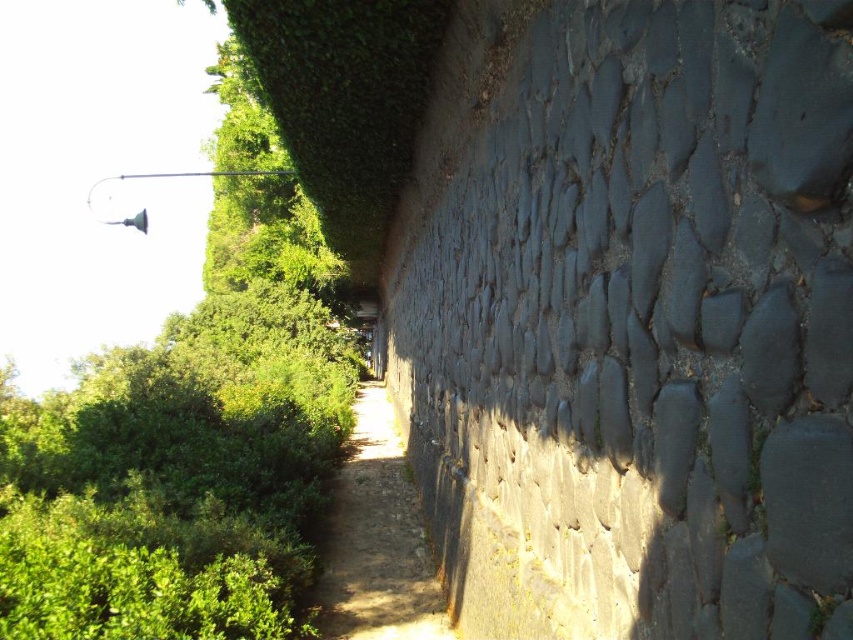
Question: Is dark gray stone wall at right smaller than green leafy tree at upper left?

Choices:
 (A) no
 (B) yes

Answer: (B)

Question: Does green leafy tree at upper left have a lesser width compared to dirt path at center?

Choices:
 (A) no
 (B) yes

Answer: (A)

Question: Which point is farther to the camera?

Choices:
 (A) (370, 448)
 (B) (235, 499)
 (C) (647, 99)

Answer: (A)

Question: Which is nearer to the dark gray stone wall at right?

Choices:
 (A) green leafy tree at upper left
 (B) dirt path at center

Answer: (B)

Question: Is dark gray stone wall at right positioned at the back of dirt path at center?

Choices:
 (A) no
 (B) yes

Answer: (A)

Question: Which object is closer to the camera taking this photo?

Choices:
 (A) green leafy tree at upper left
 (B) dark gray stone wall at right
 (C) dirt path at center

Answer: (B)